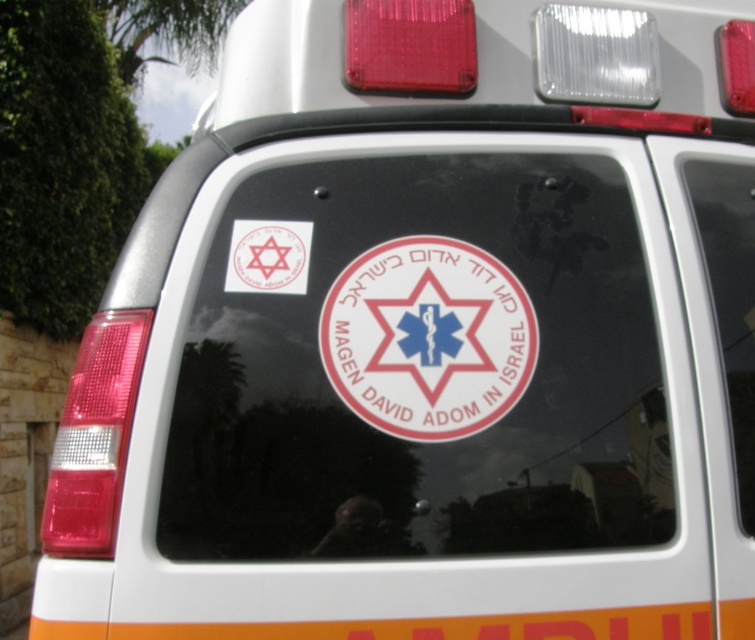
You are a pedestrian standing behind the ambulance in the image. You notice two stickers on the rear window of the ambulance. The first is a white sticker at center, and the second is a matte white sticker at upper left. Which sticker appears closer to you?

The white sticker at center is closer to the viewer than the matte white sticker at upper left.

You are a delivery person standing behind the ambulance and need to place a package on the camera. The package is 1.5 meters long. Will the package fit between the white sticker at center and the camera?

The distance between the white sticker at center and the camera is 1.47 meters, which is shorter than the package length of 1.5 meters. Therefore, the package will not fit between them.

Looking at this image, you are a driver approaching the rear of the ambulance. You notice two white stickers on the rear window. One is the white sticker at center and the other is the matte white sticker at upper left. Which sticker is positioned lower on the window?

The white sticker at center is positioned lower on the window than the matte white sticker at upper left.